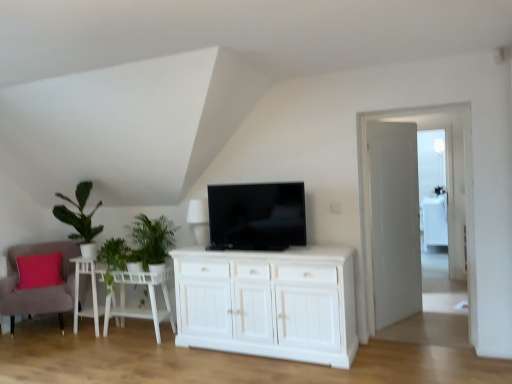
Where is `green leafy plant at lower left, arranged as the second plant when viewed from the left`? green leafy plant at lower left, arranged as the second plant when viewed from the left is located at coordinates (153, 238).

Find the location of `transparent glass door at right, which is counted as the 1th glass door, starting from the left`. transparent glass door at right, which is counted as the 1th glass door, starting from the left is located at coordinates (447, 190).

Image resolution: width=512 pixels, height=384 pixels. What do you see at coordinates (432, 188) in the screenshot?
I see `transparent glass door at right, the 1th glass door in the right-to-left sequence` at bounding box center [432, 188].

At what (x,y) coordinates should I click in order to perform the action: click on transparent glass door at right, the 1th glass door in the right-to-left sequence. Please return your answer as a coordinate pair (x, y). The image size is (512, 384). Looking at the image, I should click on (432, 188).

What do you see at coordinates (140, 309) in the screenshot? This screenshot has width=512, height=384. I see `white matte table at lower left` at bounding box center [140, 309].

The height and width of the screenshot is (384, 512). I want to click on green leafy plant at lower left, placed as the 1th plant when sorted from right to left, so click(x=153, y=238).

Considering the sizes of velvet pink armchair at lower left and transparent glass door at right, the second glass door in the right-to-left sequence, in the image, is velvet pink armchair at lower left wider or thinner than transparent glass door at right, the second glass door in the right-to-left sequence,?

In the image, velvet pink armchair at lower left appears to be wider than transparent glass door at right, the second glass door in the right-to-left sequence.

From a real-world perspective, is velvet pink armchair at lower left on transparent glass door at right, which is counted as the 1th glass door, starting from the left?

No, from a real-world perspective, velvet pink armchair at lower left is not above transparent glass door at right, which is counted as the 1th glass door, starting from the left.

Is velvet pink armchair at lower left facing away from transparent glass door at right, the first glass door viewed from the front?

No, velvet pink armchair at lower left is not facing the opposite direction of transparent glass door at right, the first glass door viewed from the front.

Who is smaller, velvet pink armchair at lower left or transparent glass door at right, arranged as the 2th glass door when viewed from the back?

A: Smaller between the two is transparent glass door at right, arranged as the 2th glass door when viewed from the back.

Which object is wider, black glossy tv at center or velvet pink armchair at lower left?

velvet pink armchair at lower left.

From a real-world perspective, is black glossy tv at center under velvet pink armchair at lower left?

No, from a real-world perspective, black glossy tv at center is not beneath velvet pink armchair at lower left.

Which is more to the right, black glossy tv at center or velvet pink armchair at lower left?

black glossy tv at center.

Is black glossy tv at center turned away from velvet pink armchair at lower left?

black glossy tv at center does not have its back to velvet pink armchair at lower left.

Could you tell me if transparent glass door at right, the 1th glass door in the right-to-left sequence, is facing green leafy plant at lower left, arranged as the second plant when viewed from the left?

No, transparent glass door at right, the 1th glass door in the right-to-left sequence, is not aimed at green leafy plant at lower left, arranged as the second plant when viewed from the left.

Looking at this image, between transparent glass door at right, the 1th glass door in the right-to-left sequence, and green leafy plant at lower left, placed as the 1th plant when sorted from right to left, which one appears on the right side from the viewer's perspective?

Positioned to the right is transparent glass door at right, the 1th glass door in the right-to-left sequence.

Is transparent glass door at right, which ranks as the second glass door in left-to-right order, not within green leafy plant at lower left, arranged as the second plant when viewed from the left?

transparent glass door at right, which ranks as the second glass door in left-to-right order, lies outside green leafy plant at lower left, arranged as the second plant when viewed from the left,'s area.

Is transparent glass door at right, which ranks as the second glass door in left-to-right order, wider or thinner than green leafy plant at lower left, arranged as the second plant when viewed from the left?

In the image, transparent glass door at right, which ranks as the second glass door in left-to-right order, appears to be more narrow than green leafy plant at lower left, arranged as the second plant when viewed from the left.

From the image's perspective, who appears lower, white matte table at lower left or green leafy plant at left?

white matte table at lower left is shown below in the image.

What's the angular difference between white matte table at lower left and green leafy plant at left's facing directions?

white matte table at lower left and green leafy plant at left are facing 2.86 degrees away from each other.

Which object is wider, white matte table at lower left or green leafy plant at left?

With larger width is green leafy plant at left.

Are white matte table at lower left and green leafy plant at left far apart?

They are positioned close to each other.

Would you say white wooden door at right is inside or outside white matte table at lower left?

white wooden door at right is located beyond the bounds of white matte table at lower left.

Which of these two, white wooden door at right or white matte table at lower left, stands shorter?

Standing shorter between the two is white matte table at lower left.

From the picture: Is white matte table at lower left at the back of white wooden door at right?

No, white matte table at lower left is not at the back of white wooden door at right.

Is point (423, 210) less distant than point (55, 194)?

No, (423, 210) is behind (55, 194).

Can you confirm if transparent glass door at right, which appears as the first glass door when viewed from the back, is taller than green leafy plant at left?

Indeed, transparent glass door at right, which appears as the first glass door when viewed from the back, has a greater height compared to green leafy plant at left.

Considering their positions, is transparent glass door at right, the 1th glass door in the right-to-left sequence, located in front of or behind green leafy plant at left?

transparent glass door at right, the 1th glass door in the right-to-left sequence, is behind green leafy plant at left.

Considering the positions of objects transparent glass door at right, which appears as the first glass door when viewed from the back, and green leafy plant at left in the image provided, who is more to the left, transparent glass door at right, which appears as the first glass door when viewed from the back, or green leafy plant at left?

Positioned to the left is green leafy plant at left.

In the image, is white matte table at lower left positioned in front of or behind white wood side table at lower left?

Visually, white matte table at lower left is located in front of white wood side table at lower left.

Does white matte table at lower left touch white wood side table at lower left?

They are not placed beside each other.

This screenshot has height=384, width=512. Find the location of `side table behind the white matte table at lower left`. side table behind the white matte table at lower left is located at coordinates (92, 291).

What's the angular difference between white matte table at lower left and white wood side table at lower left's facing directions?

3.9 degrees.

This screenshot has width=512, height=384. Find the location of `chair located behind the transparent glass door at right, the first glass door viewed from the front`. chair located behind the transparent glass door at right, the first glass door viewed from the front is located at coordinates (38, 288).

I want to click on chair below the black glossy tv at center (from the image's perspective), so click(x=38, y=288).

Estimate the real-world distances between objects in this image. Which object is closer to green leafy plant at left, black glossy tv at center or velvet pink armchair at lower left?

velvet pink armchair at lower left.

From the image, which object appears to be farther from green leafy plant at left, green leafy plant at lower left, placed as the 1th plant when sorted from right to left, or white matte table at lower left?

green leafy plant at lower left, placed as the 1th plant when sorted from right to left, is positioned further to the anchor green leafy plant at left.

From the image, which object appears to be nearer to white wood side table at lower left, velvet pink armchair at lower left or green leafy plant at lower left, placed as the 1th plant when sorted from right to left?

velvet pink armchair at lower left.

Based on their spatial positions, is velvet pink armchair at lower left or green leafy plant at left further from white matte table at lower left?

green leafy plant at left is positioned further to the anchor white matte table at lower left.

In the scene shown: Estimate the real-world distances between objects in this image. Which object is further from transparent glass door at right, which ranks as the second glass door in left-to-right order, white wooden door at right or green leafy plant at left, positioned as the 2th plant in right-to-left order?

green leafy plant at left, positioned as the 2th plant in right-to-left order, is positioned further to the anchor transparent glass door at right, which ranks as the second glass door in left-to-right order.

From the image, which object appears to be farther from green leafy plant at lower left, placed as the 1th plant when sorted from right to left, transparent glass door at right, the 1th glass door in the right-to-left sequence, or white wooden door at right?

transparent glass door at right, the 1th glass door in the right-to-left sequence, lies further to green leafy plant at lower left, placed as the 1th plant when sorted from right to left, than the other object.

Based on their spatial positions, is black glossy tv at center or white wood side table at lower left further from transparent glass door at right, the second glass door in the right-to-left sequence?

white wood side table at lower left is positioned further to the anchor transparent glass door at right, the second glass door in the right-to-left sequence.

From the image, which object appears to be farther from white matte table at lower left, black glossy tv at center or green leafy plant at lower left, placed as the 1th plant when sorted from right to left?

black glossy tv at center is further to white matte table at lower left.

Locate an element on the screen. The height and width of the screenshot is (384, 512). door situated between white matte table at lower left and transparent glass door at right, which ranks as the second glass door in left-to-right order, from left to right is located at coordinates (394, 221).

The height and width of the screenshot is (384, 512). Find the location of `table situated between velvet pink armchair at lower left and transparent glass door at right, the second glass door when ordered from front to back, from left to right`. table situated between velvet pink armchair at lower left and transparent glass door at right, the second glass door when ordered from front to back, from left to right is located at coordinates (140, 309).

The width and height of the screenshot is (512, 384). What are the coordinates of `houseplant between velvet pink armchair at lower left and transparent glass door at right, the first glass door viewed from the front, in the horizontal direction` in the screenshot? It's located at (80, 219).

Locate an element on the screen. The image size is (512, 384). plant between white wood side table at lower left and white matte table at lower left from left to right is located at coordinates (114, 259).